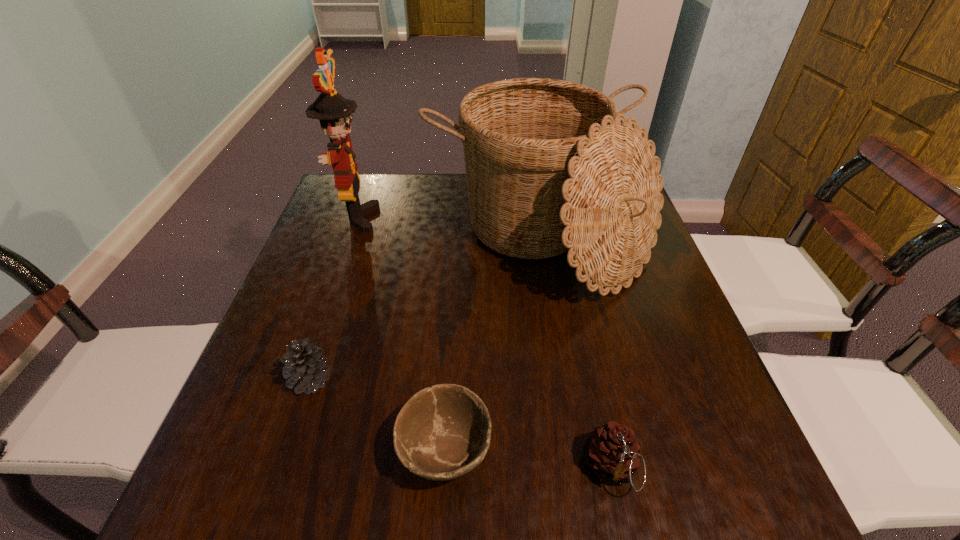
Image resolution: width=960 pixels, height=540 pixels. I want to click on the tallest object, so click(x=334, y=112).

I want to click on basket, so click(549, 168).

You are a GUI agent. You are given a task and a screenshot of the screen. Output one action in this format:
    pyautogui.click(x=<x>, y=<y>)
    Task: Click on the farther pinecone
    The height and width of the screenshot is (540, 960).
    Given the screenshot: What is the action you would take?
    pyautogui.click(x=305, y=365)

Find the location of `the third farthest object`. the third farthest object is located at coordinates (305, 365).

This screenshot has height=540, width=960. I want to click on the right pinecone, so click(612, 452).

You are a GUI agent. You are given a task and a screenshot of the screen. Output one action in this format:
    pyautogui.click(x=<x>, y=<y>)
    Task: Click on the bowl
    
    Given the screenshot: What is the action you would take?
    pyautogui.click(x=443, y=432)

Locate an element on the screen. The width and height of the screenshot is (960, 540). vacant space located on the front-facing side of the nutcracker is located at coordinates (440, 218).

Where is `free space located on the front of the fourth shortest object`? This screenshot has width=960, height=540. free space located on the front of the fourth shortest object is located at coordinates (576, 458).

Find the location of a particular element. Image resolution: width=960 pixels, height=540 pixels. vacant space located on the front of the left pinecone is located at coordinates (289, 444).

At what (x,y) coordinates should I click in order to perform the action: click on free spot located on the back of the shortest object. Please return your answer as a coordinate pair (x, y). Looking at the image, I should click on (453, 317).